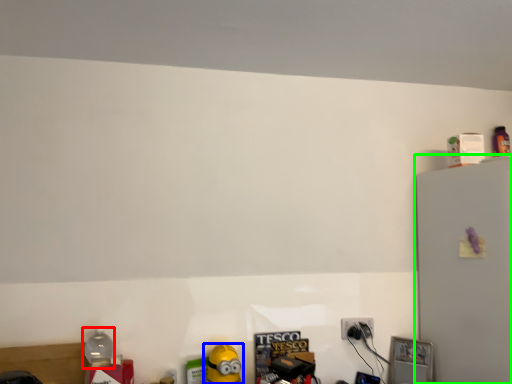
Question: Which object is positioned farthest from bottle (highlighted by a red box)? Select from toy (highlighted by a blue box) and fridge (highlighted by a green box).

Choices:
 (A) toy
 (B) fridge

Answer: (B)